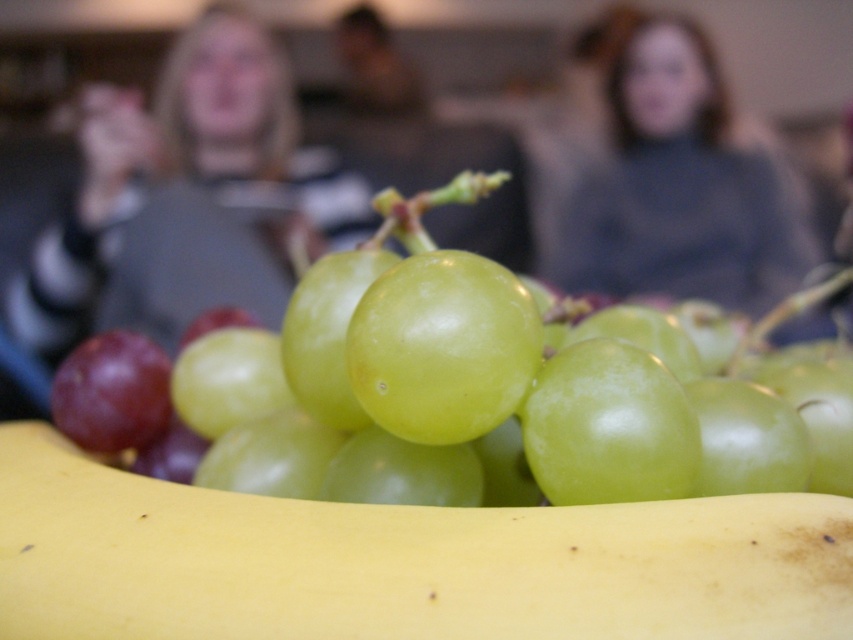
You are standing in front of a fruit arrangement. There is a green shiny grape at center. Can you tell me what is located exactly at the coordinates point (477, 396)?

At point (477, 396) lies the green shiny grape at center.

From the picture: You are taking a photo of the grapes and want to focus on the point closer to the camera. Which point should you choose between point (654, 397) and point (189, 212)?

Point (654, 397) is closer to the camera than point (189, 212), so you should choose point (654, 397) to focus on the grapes.